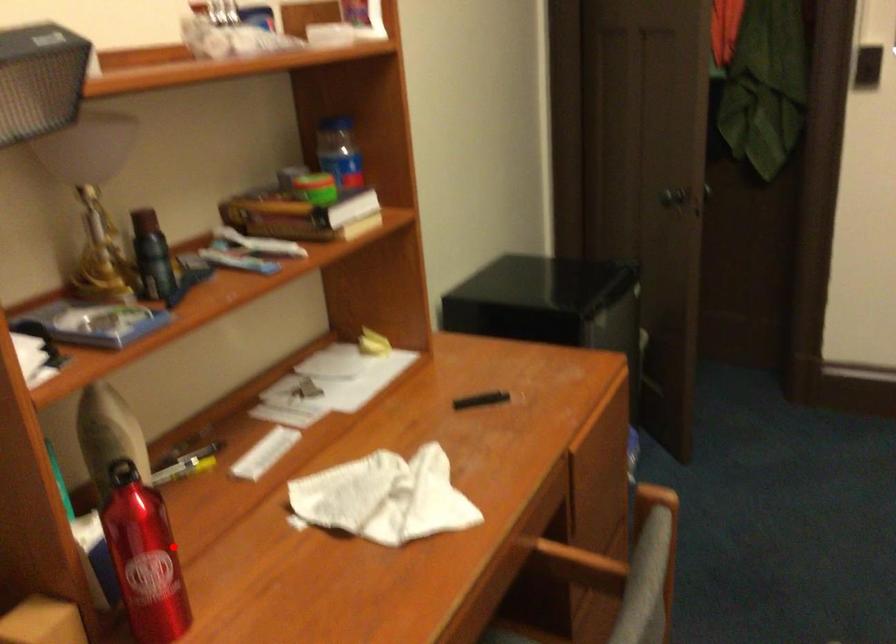
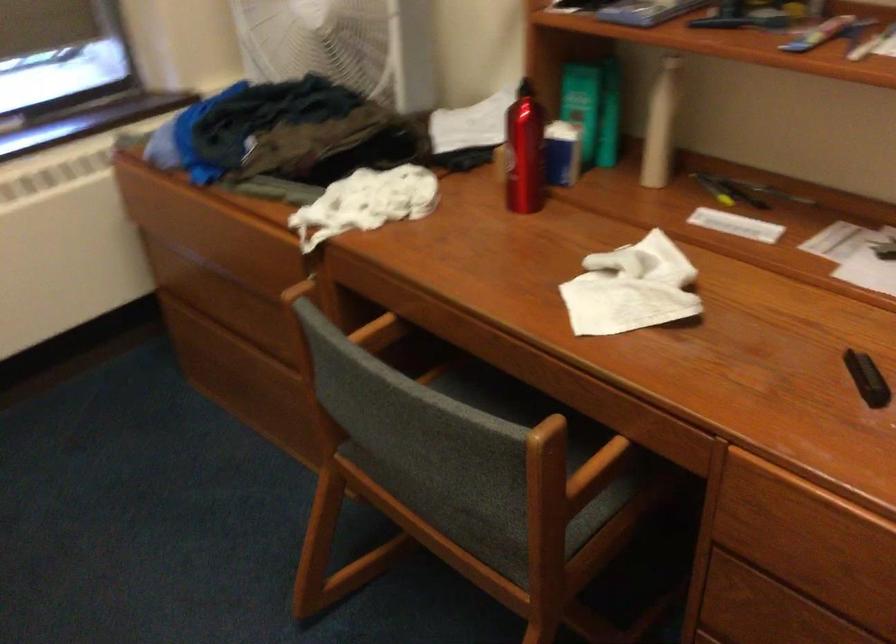
Question: I am providing you with two images of the same scene from different viewpoints. Given a red point in image1, look at the same physical point in image2. Is it:

Choices:
 (A) Closer to the viewpoint
 (B) Farther from the viewpoint

Answer: (B)